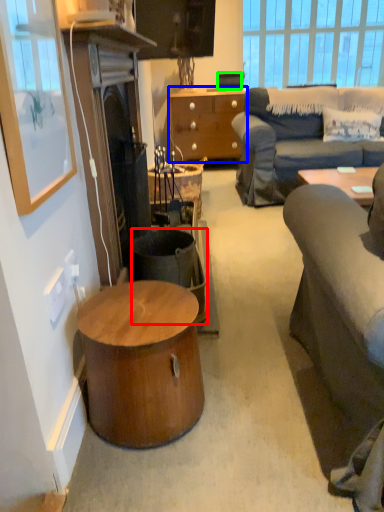
Question: Which object is positioned farthest from trash bin/can (highlighted by a red box)? Select from cabinetry (highlighted by a blue box) and speaker (highlighted by a green box).

Choices:
 (A) cabinetry
 (B) speaker

Answer: (B)